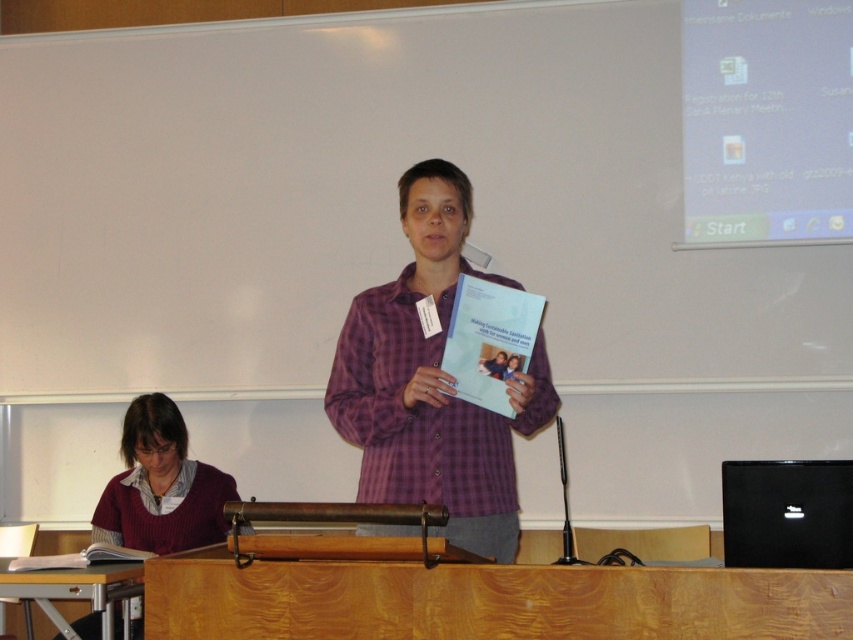
Question: Does purple checkered shirt at center have a lesser width compared to maroon sweater at lower left?

Choices:
 (A) no
 (B) yes

Answer: (A)

Question: From the image, what is the correct spatial relationship of purple checkered shirt at center in relation to maroon sweater at lower left?

Choices:
 (A) right
 (B) left

Answer: (A)

Question: Is purple checkered shirt at center below maroon sweater at lower left?

Choices:
 (A) yes
 (B) no

Answer: (B)

Question: Among these objects, which one is nearest to the camera?

Choices:
 (A) maroon sweater at lower left
 (B) purple checkered shirt at center

Answer: (B)